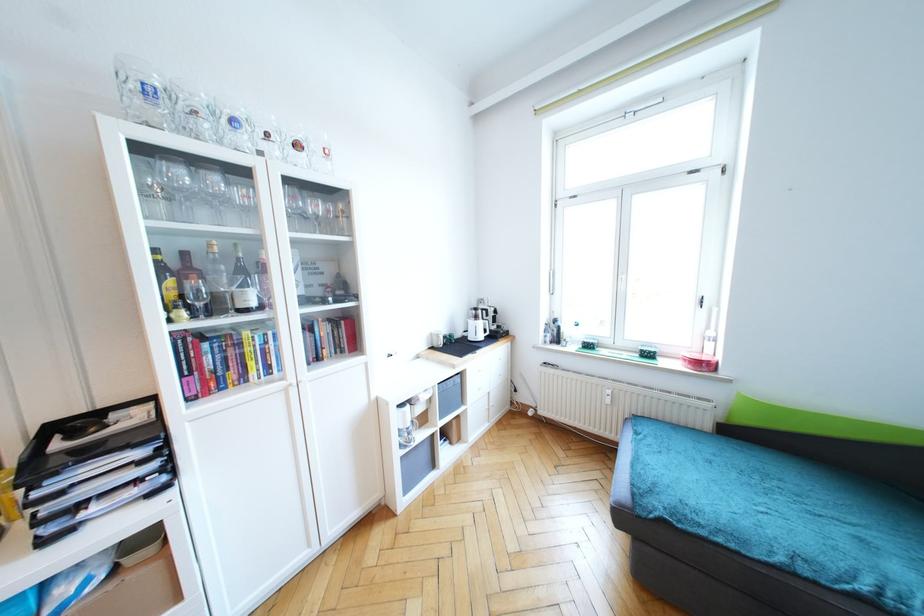
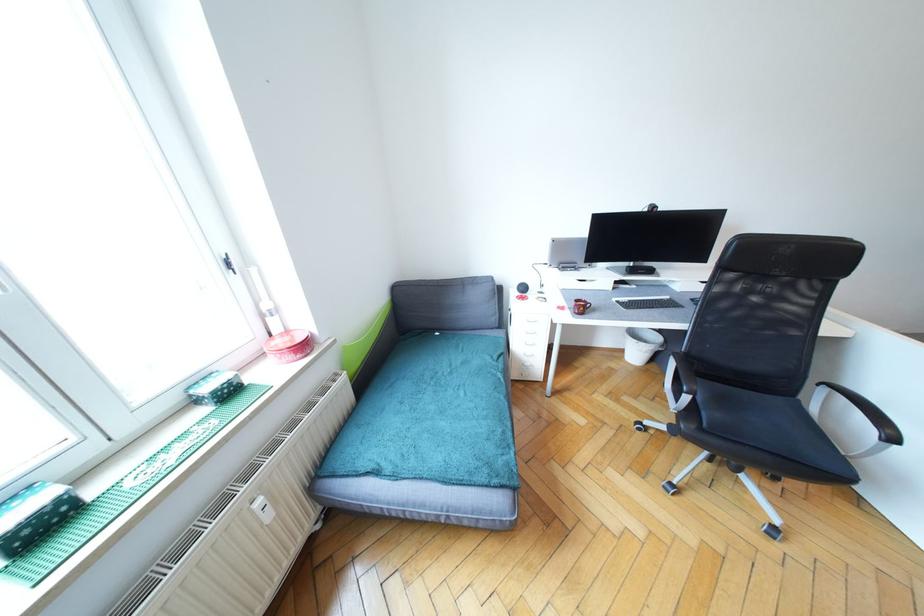
Locate, in the second image, the point that corresponds to (646,352) in the first image.

(217, 392)